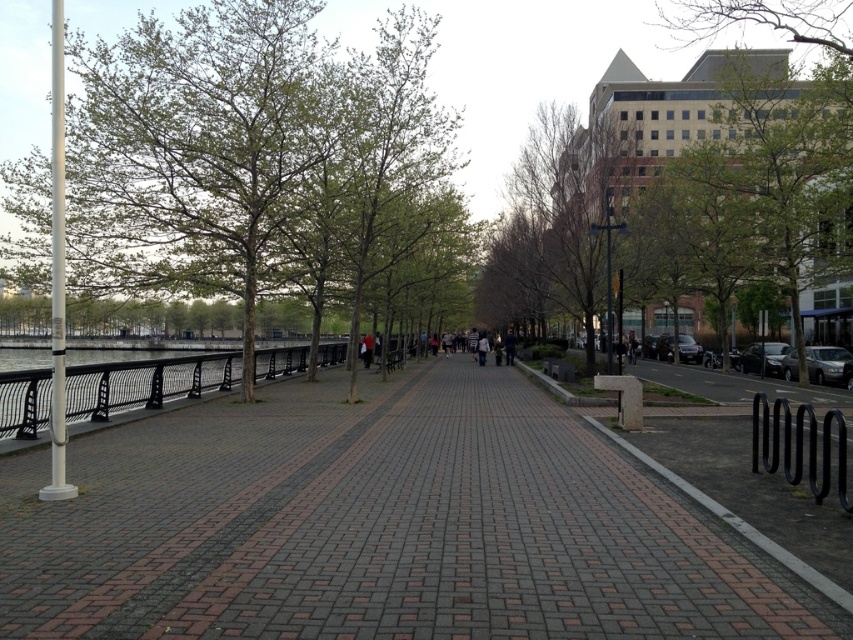
You are a delivery person carrying a large package that is 1.5 meters wide. You need to pass through the walkway between the shiny black car at right and the dark brown leather jacket at center. Can your package fit through the space between them?

The shiny black car at right is wider than the dark brown leather jacket at center. Since the package is 1.5 meters wide, it depends on the actual width of the car and jacket. However, since the car is wider, the space between them might be sufficient. Without exact measurements, it is uncertain.

You are standing on the pedestrian walkway in the image and want to walk towards the white pole on the left. There are two points marked on the walkway, point 1 at coordinates point [146,209] and point 2 at coordinates point [633,346]. Which point will you reach first as you walk towards the white pole?

Point [146,209] is in front of point [633,346], so you will reach point [146,209] first as you walk towards the white pole.

You are a photographer planning to take a portrait of someone wearing the dark brown leather jacket at center against the backdrop of the green leafy tree at left. Considering the sizes of both objects, will the tree appear wider than the jacket in the photo?

Yes, the green leafy tree at left is wider than the dark brown leather jacket at center, so the tree will appear wider in the photo.